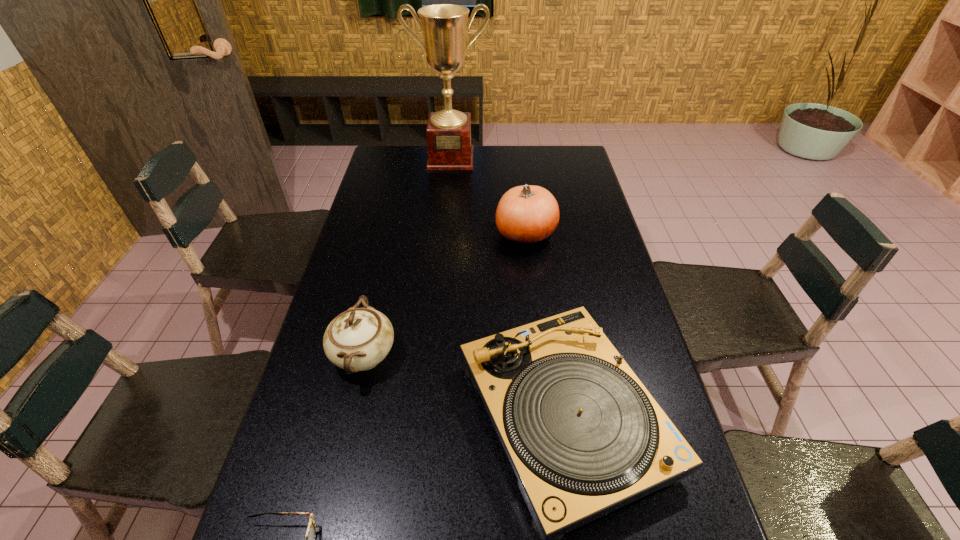
The height and width of the screenshot is (540, 960). Find the location of `object present at the far left corner`. object present at the far left corner is located at coordinates (448, 134).

This screenshot has width=960, height=540. I want to click on free space at the left edge of the desktop, so click(x=314, y=489).

What are the coordinates of `vacant area at the right edge of the desktop` in the screenshot? It's located at (609, 326).

The image size is (960, 540). I want to click on vacant area between the chinaware and the pumpkin, so click(444, 295).

Where is `object that is the third closest to the shortest object`? object that is the third closest to the shortest object is located at coordinates (527, 214).

Where is `the third closest object to the chinaware`? The height and width of the screenshot is (540, 960). the third closest object to the chinaware is located at coordinates (527, 214).

The width and height of the screenshot is (960, 540). I want to click on free spot that satisfies the following two spatial constraints: 1. on the plaque of the tallest object; 2. on the left side of the pumpkin, so click(444, 233).

You are a GUI agent. You are given a task and a screenshot of the screen. Output one action in this format:
    pyautogui.click(x=<x>, y=<y>)
    Task: Click on the vacant area in the image that satisfies the following two spatial constraints: 1. on the plaque of the farthest object; 2. on the left side of the pumpkin
    This screenshot has width=960, height=540.
    Given the screenshot: What is the action you would take?
    [444, 233]